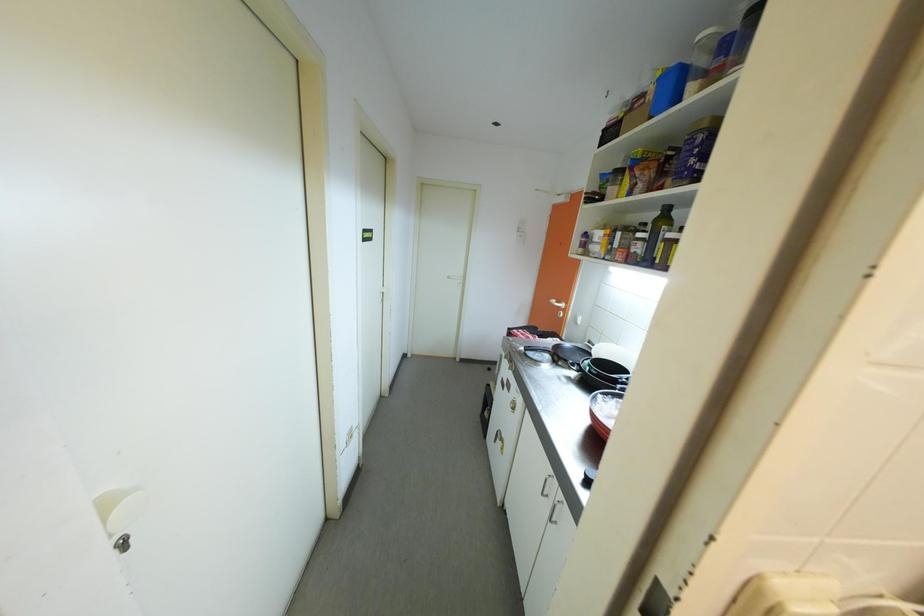
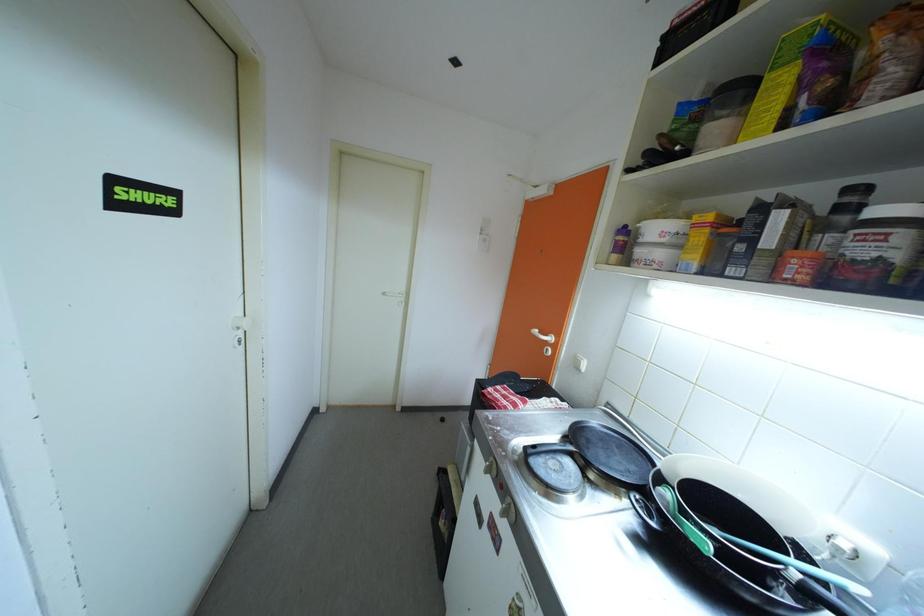
Question: In a continuous first-person perspective shot, in which direction is the camera moving?

Choices:
 (A) Left
 (B) Right
 (C) Forward
 (D) Backward

Answer: (C)